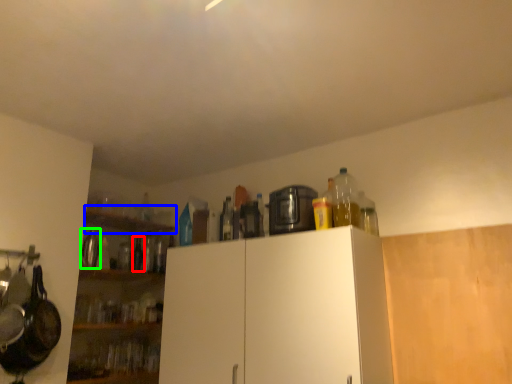
Question: Considering the real-world distances, which object is closest to bottle (highlighted by a red box)? shelf (highlighted by a blue box) or appliance (highlighted by a green box).

Choices:
 (A) shelf
 (B) appliance

Answer: (A)